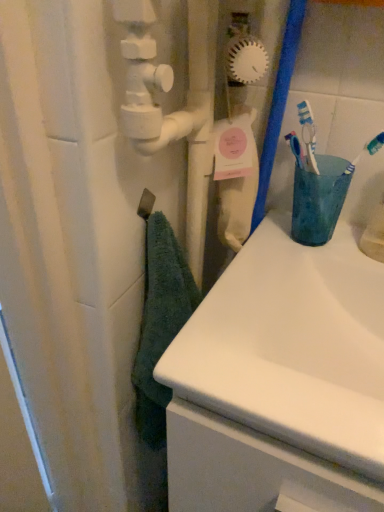
Question: From a real-world perspective, is teal soft towel at left above or below white glossy sink at center?

Choices:
 (A) above
 (B) below

Answer: (A)

Question: Relative to white glossy sink at center, is teal soft towel at left in front or behind?

Choices:
 (A) front
 (B) behind

Answer: (B)

Question: Which is farther from the white glossy sink at center?

Choices:
 (A) teal soft towel at left
 (B) matte plastic cup at right

Answer: (A)

Question: Which object is positioned farthest from the matte plastic cup at right?

Choices:
 (A) white glossy sink at center
 (B) teal soft towel at left

Answer: (B)